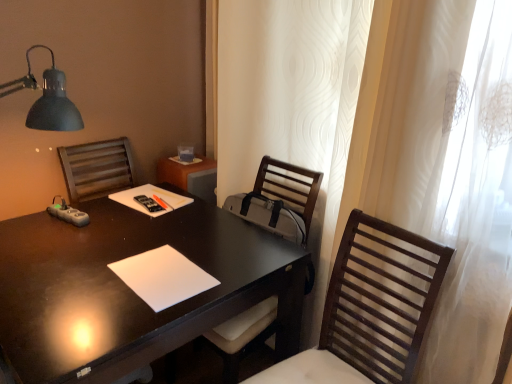
Find the location of `black plastic remote control at center`. black plastic remote control at center is located at coordinates (148, 203).

Describe the element at coordinates (130, 289) in the screenshot. I see `black glossy desk at center` at that location.

At what (x,y) coordinates should I click in order to perform the action: click on white sheer curtain at right. Please return your answer as a coordinate pair (x, y). Looking at the image, I should click on (441, 166).

What do you see at coordinates (163, 277) in the screenshot?
I see `white matte notepad at center` at bounding box center [163, 277].

The image size is (512, 384). Describe the element at coordinates (371, 308) in the screenshot. I see `wooden slats chair at right, which is the 2th chair in back-to-front order` at that location.

Image resolution: width=512 pixels, height=384 pixels. I want to click on black plastic remote control at center, so click(148, 203).

Does wooden chair at center, positioned as the 2th chair in front-to-back order, have a lesser width compared to wooden slats chair at right, which is the 2th chair in back-to-front order?

Incorrect, the width of wooden chair at center, positioned as the 2th chair in front-to-back order, is not less than that of wooden slats chair at right, which is the 2th chair in back-to-front order.

From the picture: From a real-world perspective, is wooden chair at center, positioned as the 2th chair in front-to-back order, on top of wooden slats chair at right, which is the 2th chair in back-to-front order?

Incorrect, from a real-world perspective, wooden chair at center, positioned as the 2th chair in front-to-back order, is lower than wooden slats chair at right, which is the 2th chair in back-to-front order.

Consider the image. Could you measure the distance between wooden chair at center, positioned as the 2th chair in front-to-back order, and wooden slats chair at right, which is the 2th chair in back-to-front order?

wooden chair at center, positioned as the 2th chair in front-to-back order, and wooden slats chair at right, which is the 2th chair in back-to-front order, are 13.61 inches apart from each other.

Which is less distant, (228,340) or (265,380)?

Point (228,340).

In terms of width, does white sheer curtain at right look wider or thinner when compared to wooden chair at center, which ranks as the first chair in back-to-front order?

white sheer curtain at right is thinner than wooden chair at center, which ranks as the first chair in back-to-front order.

At what (x,y) coordinates should I click in order to perform the action: click on the 2nd chair to the left of the white sheer curtain at right, starting your count from the anchor. Please return your answer as a coordinate pair (x, y). The width and height of the screenshot is (512, 384). Looking at the image, I should click on (279, 200).

Are white sheer curtain at right and wooden chair at center, which ranks as the first chair in back-to-front order, beside each other?

No, white sheer curtain at right is not in contact with wooden chair at center, which ranks as the first chair in back-to-front order.

Could you measure the distance between white sheer curtain at right and wooden chair at center, positioned as the 2th chair in front-to-back order?

white sheer curtain at right and wooden chair at center, positioned as the 2th chair in front-to-back order, are 45.36 centimeters apart from each other.

Between wooden slats chair at right, marked as the first chair in a front-to-back arrangement, and black plastic remote control at center, which one has smaller size?

black plastic remote control at center is smaller.

Can you tell me how much wooden slats chair at right, which is the 2th chair in back-to-front order, and black plastic remote control at center differ in facing direction?

84.8 degrees.

From a real-world perspective, is wooden slats chair at right, which is the 2th chair in back-to-front order, physically below black plastic remote control at center?

Yes, from a real-world perspective, wooden slats chair at right, which is the 2th chair in back-to-front order, is beneath black plastic remote control at center.

Which of these two, wooden slats chair at right, marked as the first chair in a front-to-back arrangement, or black plastic remote control at center, stands shorter?

black plastic remote control at center is shorter.

From a real-world perspective, is wooden chair at center, which ranks as the first chair in back-to-front order, under black plastic remote control at center?

Yes, from a real-world perspective, wooden chair at center, which ranks as the first chair in back-to-front order, is under black plastic remote control at center.

Considering the sizes of wooden chair at center, positioned as the 2th chair in front-to-back order, and black plastic remote control at center in the image, is wooden chair at center, positioned as the 2th chair in front-to-back order, bigger or smaller than black plastic remote control at center?

Clearly, wooden chair at center, positioned as the 2th chair in front-to-back order, is larger in size than black plastic remote control at center.

Is wooden chair at center, positioned as the 2th chair in front-to-back order, directly adjacent to black plastic remote control at center?

No.

Is wooden chair at center, which ranks as the first chair in back-to-front order, turned away from black plastic remote control at center?

No, wooden chair at center, which ranks as the first chair in back-to-front order,'s orientation is not away from black plastic remote control at center.

Can you confirm if black plastic remote control at center is wider than wooden chair at center, positioned as the 2th chair in front-to-back order?

No, black plastic remote control at center is not wider than wooden chair at center, positioned as the 2th chair in front-to-back order.

Are black plastic remote control at center and wooden chair at center, which ranks as the first chair in back-to-front order, far apart?

They are positioned close to each other.

At what (x,y) coordinates should I click in order to perform the action: click on remote control behind the wooden chair at center, positioned as the 2th chair in front-to-back order. Please return your answer as a coordinate pair (x, y). The height and width of the screenshot is (384, 512). Looking at the image, I should click on (148, 203).

Considering the relative sizes of black plastic remote control at center and wooden chair at center, which ranks as the first chair in back-to-front order, in the image provided, is black plastic remote control at center taller than wooden chair at center, which ranks as the first chair in back-to-front order,?

No.

Which point is more distant from viewer, (416,209) or (178,274)?

The point (178,274) is farther from the camera.

Can white matte notepad at center be found inside white sheer curtain at right?

Actually, white matte notepad at center is outside white sheer curtain at right.

Is white sheer curtain at right facing away from white matte notepad at center?

Yes.

From a real-world perspective, relative to white matte notepad at center, is white sheer curtain at right vertically above or below?

white sheer curtain at right is above white matte notepad at center.

From a real-world perspective, is white sheer curtain at right located beneath black glossy desk at center?

No, from a real-world perspective, white sheer curtain at right is not below black glossy desk at center.

Is white sheer curtain at right not within black glossy desk at center?

white sheer curtain at right is positioned outside black glossy desk at center.

Does white sheer curtain at right have a lesser width compared to black glossy desk at center?

Correct, the width of white sheer curtain at right is less than that of black glossy desk at center.

Is white sheer curtain at right with black glossy desk at center?

They are not placed beside each other.

Where is `chair that appears behind the wooden slats chair at right, which is the 2th chair in back-to-front order`? Image resolution: width=512 pixels, height=384 pixels. chair that appears behind the wooden slats chair at right, which is the 2th chair in back-to-front order is located at coordinates coord(279,200).

Identify the location of chair that is the 2nd object to the left of the white sheer curtain at right, starting at the anchor. point(279,200).

Which object lies further to the anchor point black plastic remote control at center, white matte notepad at center or black glossy desk at center?

white matte notepad at center.

Which object lies nearer to the anchor point white matte notepad at center, wooden slats chair at right, marked as the first chair in a front-to-back arrangement, or wooden chair at center, which ranks as the first chair in back-to-front order?

Based on the image, wooden chair at center, which ranks as the first chair in back-to-front order, appears to be nearer to white matte notepad at center.

Considering their positions, is wooden chair at center, which ranks as the first chair in back-to-front order, positioned further to white matte notepad at center than wooden slats chair at right, marked as the first chair in a front-to-back arrangement?

Based on the image, wooden slats chair at right, marked as the first chair in a front-to-back arrangement, appears to be further to white matte notepad at center.

Based on their spatial positions, is wooden slats chair at right, which is the 2th chair in back-to-front order, or black plastic remote control at center further from white matte notepad at center?

Among the two, black plastic remote control at center is located further to white matte notepad at center.

Looking at the image, which one is located closer to black plastic remote control at center, white sheer curtain at right or white matte notepad at center?

The object closer to black plastic remote control at center is white matte notepad at center.

Based on their spatial positions, is black plastic remote control at center or wooden slats chair at right, marked as the first chair in a front-to-back arrangement, closer to black glossy desk at center?

wooden slats chair at right, marked as the first chair in a front-to-back arrangement, is closer to black glossy desk at center.

Based on their spatial positions, is black plastic remote control at center or wooden slats chair at right, marked as the first chair in a front-to-back arrangement, further from white sheer curtain at right?

black plastic remote control at center lies further to white sheer curtain at right than the other object.

Based on their spatial positions, is wooden chair at center, positioned as the 2th chair in front-to-back order, or white matte notepad at center closer to white sheer curtain at right?

Among the two, wooden chair at center, positioned as the 2th chair in front-to-back order, is located nearer to white sheer curtain at right.

Image resolution: width=512 pixels, height=384 pixels. Identify the location of notepad located between black glossy desk at center and wooden slats chair at right, which is the 2th chair in back-to-front order, in the left-right direction. (163, 277).

Where is `chair located between white matte notepad at center and black plastic remote control at center in the depth direction`? chair located between white matte notepad at center and black plastic remote control at center in the depth direction is located at coordinates (279, 200).

Locate an element on the screen. The width and height of the screenshot is (512, 384). chair between black glossy desk at center and wooden slats chair at right, which is the 2th chair in back-to-front order, from left to right is located at coordinates (279, 200).

This screenshot has width=512, height=384. What are the coordinates of `desk between wooden slats chair at right, marked as the first chair in a front-to-back arrangement, and black plastic remote control at center from front to back` in the screenshot? It's located at point(130,289).